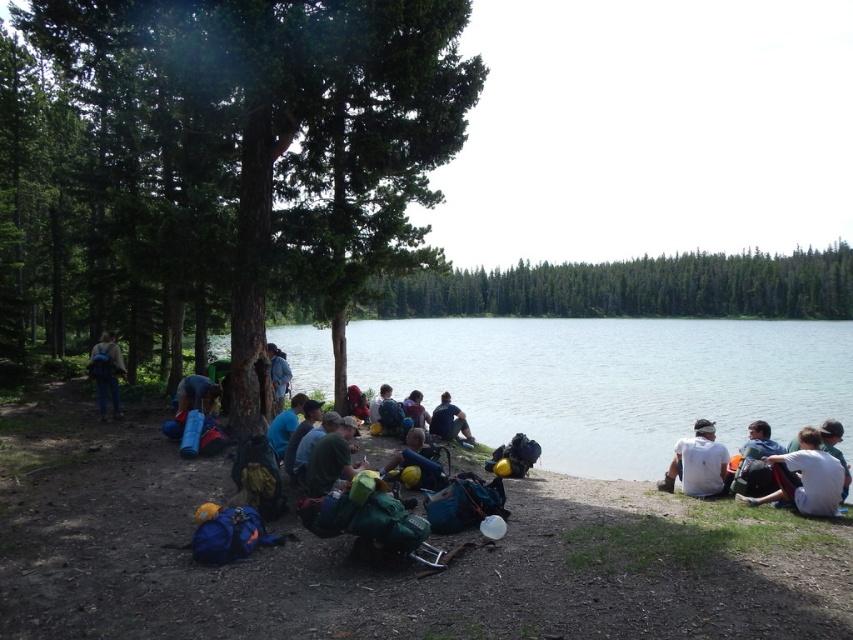
How much distance is there between green fabric backpack at lower right and blue fabric shirt at center?

green fabric backpack at lower right is 6.06 meters from blue fabric shirt at center.

Can you confirm if green fabric backpack at lower right is positioned below blue fabric shirt at center?

Indeed, green fabric backpack at lower right is positioned under blue fabric shirt at center.

Find the location of a particular element. This screenshot has width=853, height=640. green fabric backpack at lower right is located at coordinates (755, 461).

Where is `green fabric backpack at lower right`? green fabric backpack at lower right is located at coordinates (755, 461).

Is green textured tree at left taller than yellow fabric mat at center?

Yes, green textured tree at left is taller than yellow fabric mat at center.

Does green textured tree at left lie in front of yellow fabric mat at center?

No, green textured tree at left is behind yellow fabric mat at center.

Between point (187, 72) and point (416, 452), which one is positioned behind?

The point (187, 72) is behind.

Identify the location of green textured tree at left. Image resolution: width=853 pixels, height=640 pixels. (258, 148).

Based on the photo, between green fabric backpack at center and blue fabric shirt at center, which one appears on the right side from the viewer's perspective?

From the viewer's perspective, green fabric backpack at center appears more on the right side.

Between point (318, 458) and point (294, 406), which one is positioned behind?

Point (294, 406)

Find the location of `green fabric backpack at center`. green fabric backpack at center is located at coordinates (332, 458).